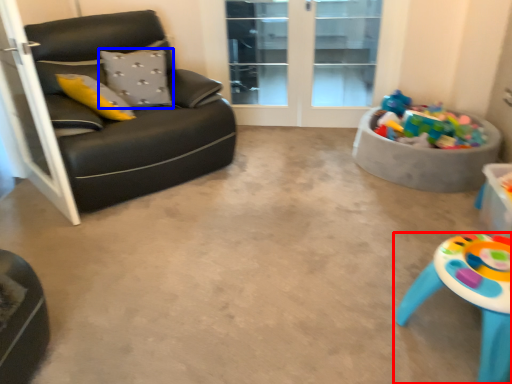
Question: Which point is further to the camera, table (highlighted by a red box) or pillow (highlighted by a blue box)?

Choices:
 (A) table
 (B) pillow

Answer: (B)